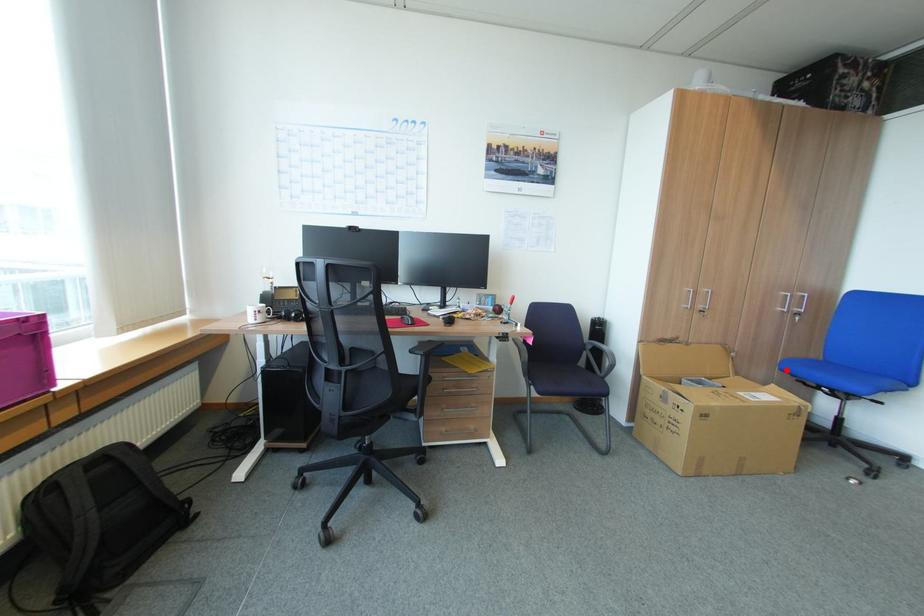
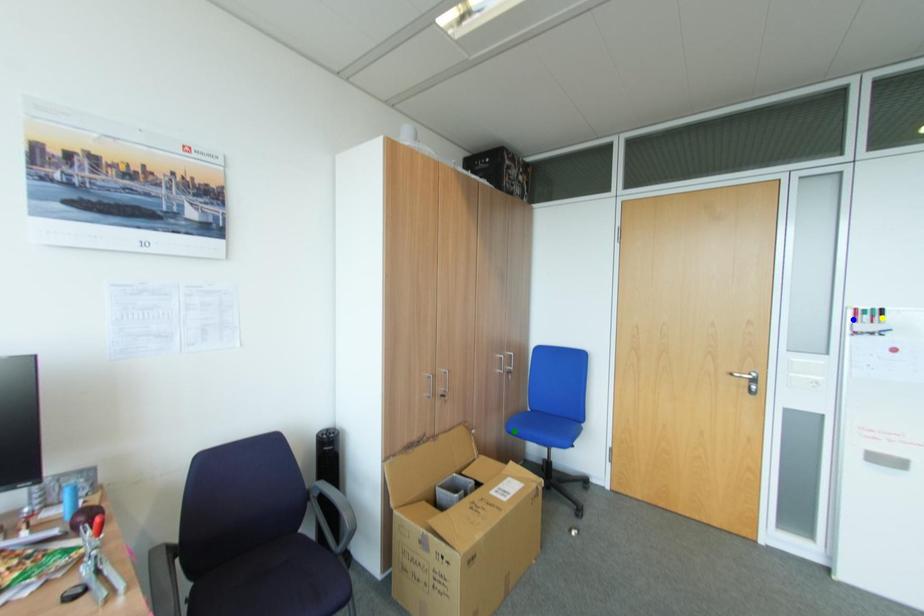
Question: I am providing you with two images of the same scene from different viewpoints. A red point is marked on the first image. You are given multiple points on the second image. Which spot in image 2 lines up with the point in image 1?

Choices:
 (A) green point
 (B) blue point
 (C) yellow point

Answer: (A)